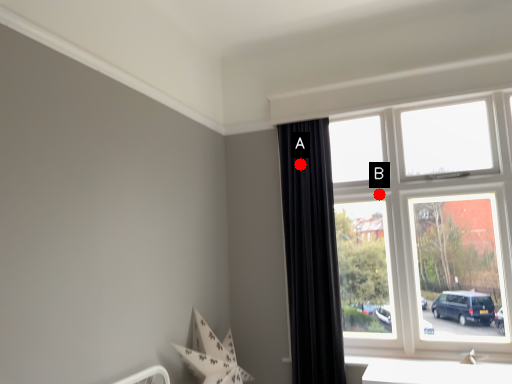
Question: Two points are circled on the image, labeled by A and B beside each circle. Among these points, which one is farthest from the camera?

Choices:
 (A) A is further
 (B) B is further

Answer: (B)